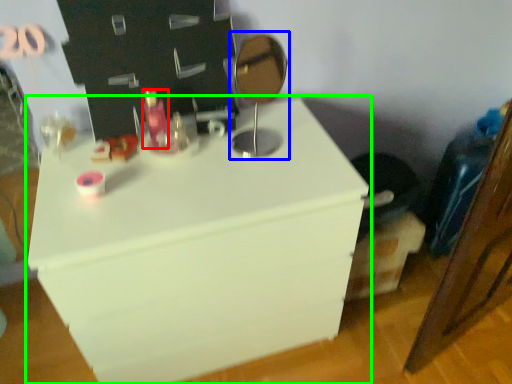
Question: Considering the real-world distances, which object is farthest from toiletry (highlighted by a red box)? table lamp (highlighted by a blue box) or furniture (highlighted by a green box)?

Choices:
 (A) table lamp
 (B) furniture

Answer: (B)